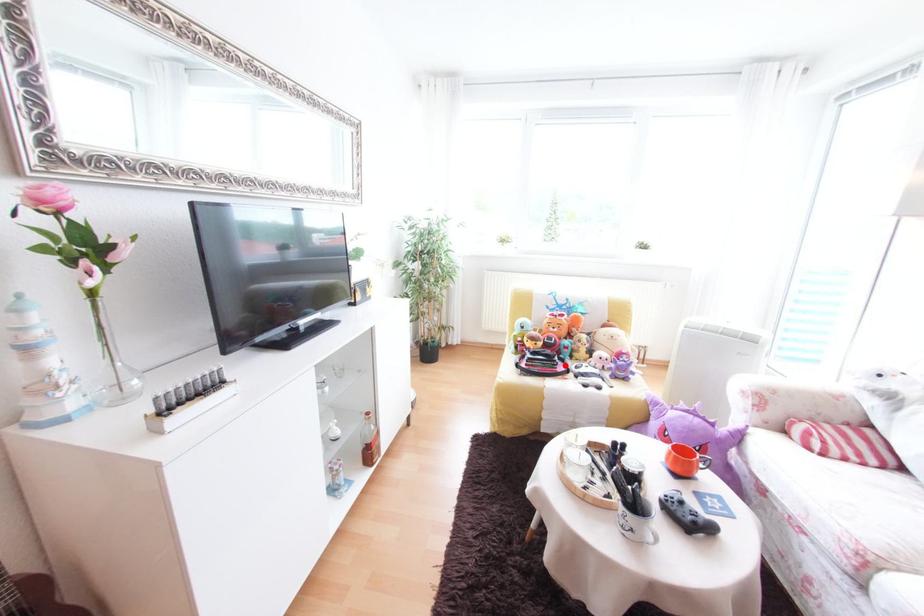
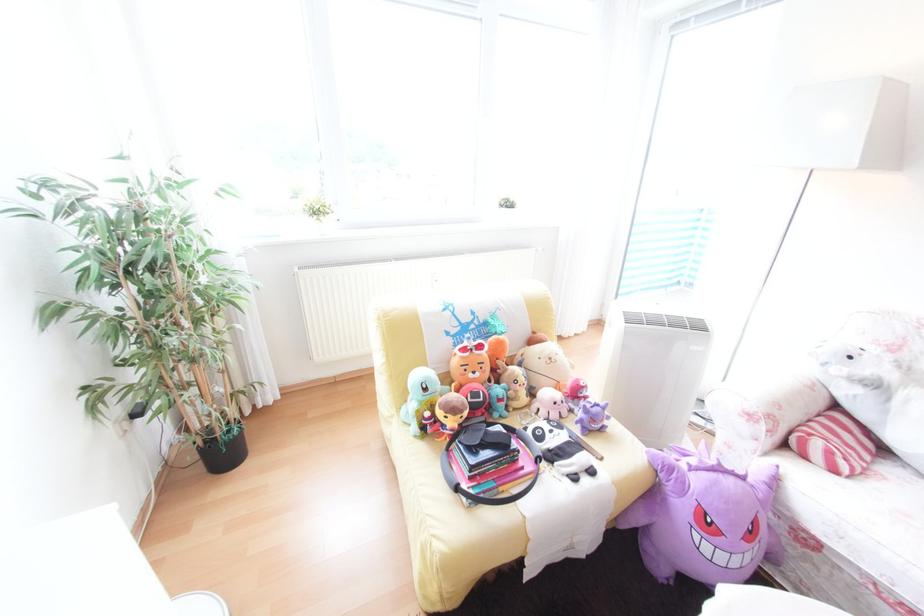
In the second image, find the point that corresponds to the highlighted location in the first image.

(526, 455)